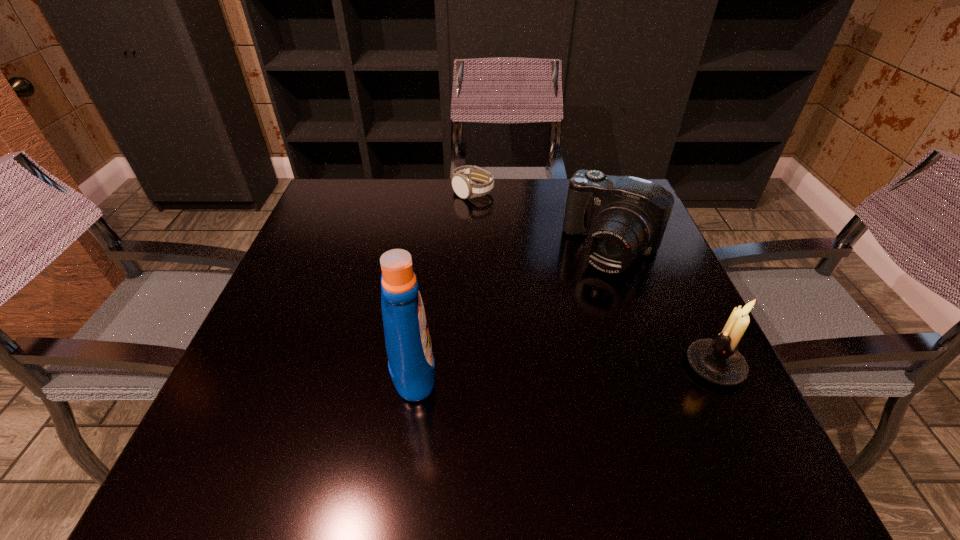
Locate an element on the screen. The image size is (960, 540). object at the far right corner is located at coordinates (622, 216).

Where is `object present at the near right corner`? The image size is (960, 540). object present at the near right corner is located at coordinates (718, 360).

At what (x,y) coordinates should I click in order to perform the action: click on blank space at the far edge of the desktop. Please return your answer as a coordinate pair (x, y). The image size is (960, 540). Looking at the image, I should click on (444, 215).

At what (x,y) coordinates should I click in order to perform the action: click on free space at the near edge of the desktop. Please return your answer as a coordinate pair (x, y). The image size is (960, 540). Looking at the image, I should click on (631, 396).

The height and width of the screenshot is (540, 960). In the image, there is a desktop. What are the coordinates of `vacant area at the left edge` in the screenshot? It's located at click(349, 279).

In the image, there is a desktop. In order to click on vacant space at the right edge in this screenshot , I will do `click(649, 369)`.

You are a GUI agent. You are given a task and a screenshot of the screen. Output one action in this format:
    pyautogui.click(x=<x>, y=<y>)
    Task: Click on the vacant region at the far left corner of the desktop
    The height and width of the screenshot is (540, 960).
    Given the screenshot: What is the action you would take?
    pyautogui.click(x=341, y=194)

Image resolution: width=960 pixels, height=540 pixels. In the image, there is a desktop. In order to click on vacant region at the near right corner in this screenshot , I will do (748, 422).

What are the coordinates of `free space that is in between the camera and the candle holder` in the screenshot? It's located at (663, 307).

Identify the location of free space between the leftmost object and the camera. Image resolution: width=960 pixels, height=540 pixels. (513, 308).